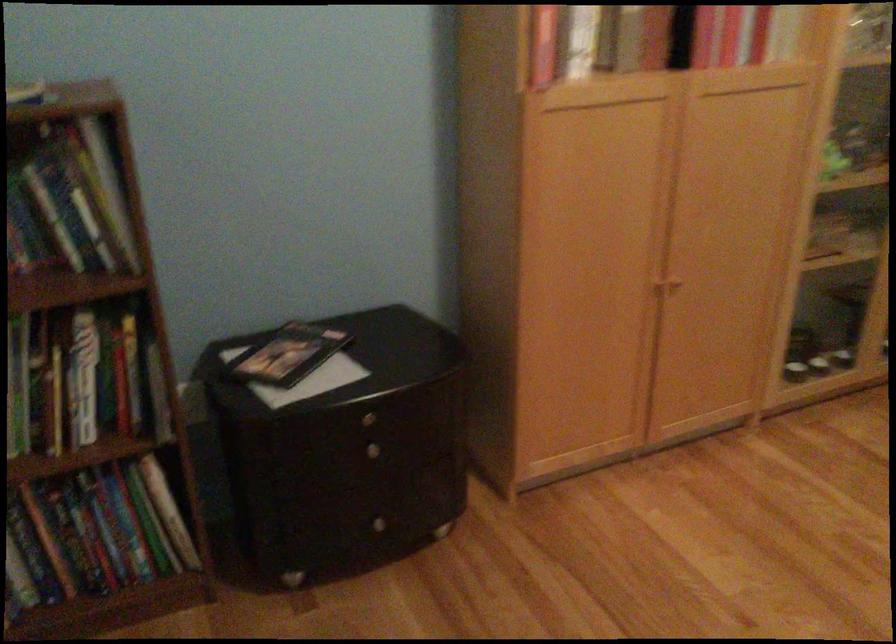
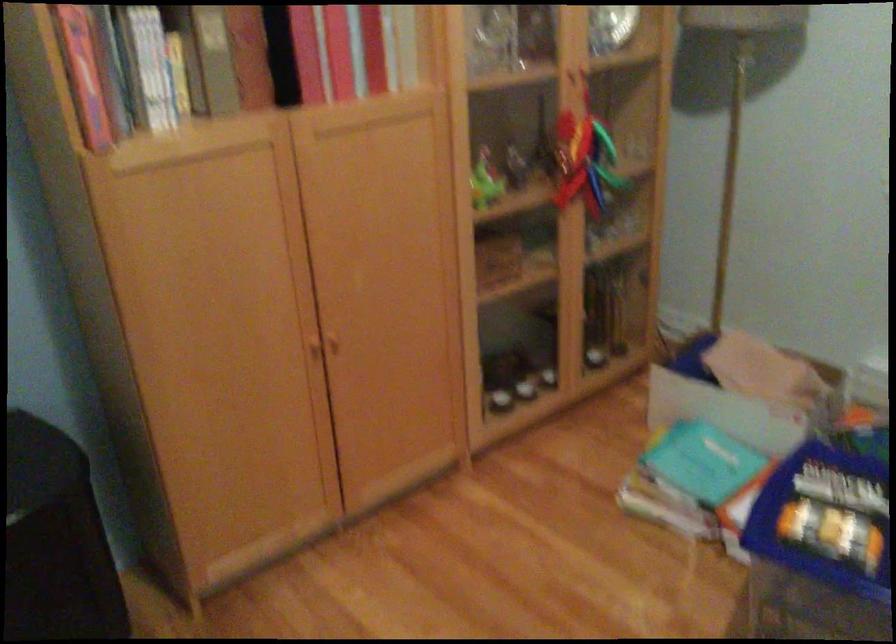
The images are taken continuously from a first-person perspective. In which direction are you moving?

The cameraman walked toward right, forward.